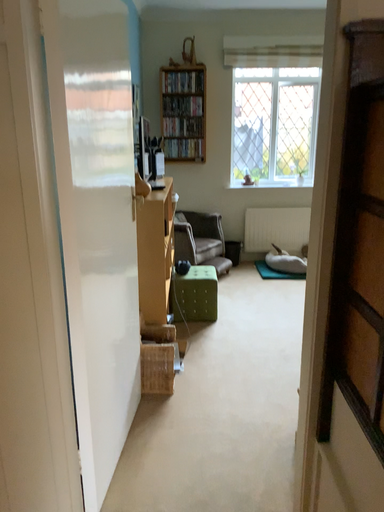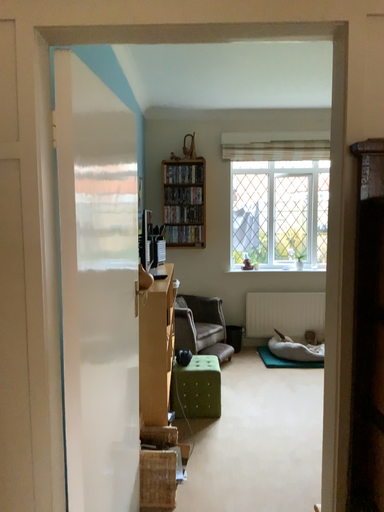
Question: How did the camera likely rotate when shooting the video?

Choices:
 (A) rotated downward
 (B) rotated upward

Answer: (B)